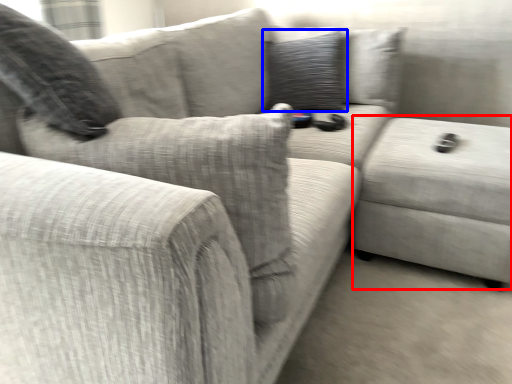
Question: Which object appears closest to the camera in this image, gray (highlighted by a red box) or pillow (highlighted by a blue box)?

Choices:
 (A) gray
 (B) pillow

Answer: (A)